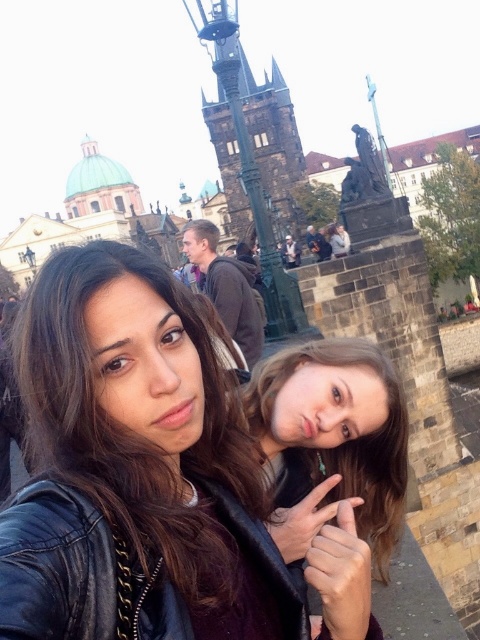
You are a tourist standing in front of the dark brown stone tower at center and the brown hair at center. Which object is located higher in the image?

The dark brown stone tower at center is higher than the brown hair at center, so the dark brown stone tower at center is located higher in the image.